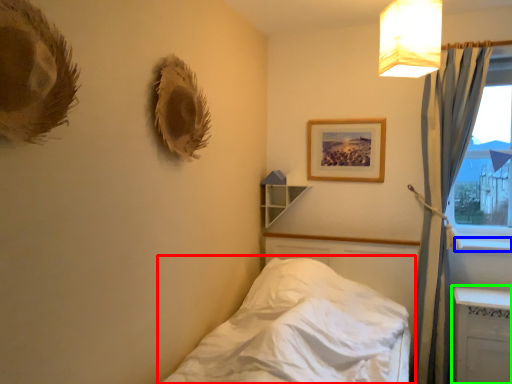
Question: Estimate the real-world distances between objects in this image. Which object is farther from bed (highlighted by a red box), window sill (highlighted by a blue box) or radiator (highlighted by a green box)?

Choices:
 (A) window sill
 (B) radiator

Answer: (A)